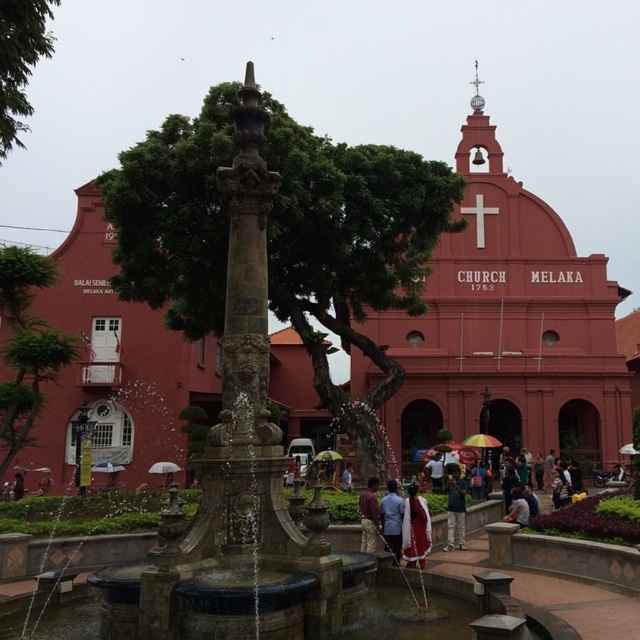
Does matte red dress at center come in front of light blue shirt at center?

No, matte red dress at center is further to the viewer.

Is matte red dress at center further to camera compared to light blue shirt at center?

Yes, matte red dress at center is further from the viewer.

Which is in front, point (403, 532) or point (401, 547)?

Positioned in front is point (401, 547).

Locate an element on the screen. The height and width of the screenshot is (640, 640). matte red dress at center is located at coordinates (416, 529).

Is point (342, 248) positioned in front of point (452, 468)?

Yes, point (342, 248) is closer to viewer.

The height and width of the screenshot is (640, 640). I want to click on green leafy tree at center, so click(349, 252).

Looking at this image, does matte red dress at center have a greater height compared to green fabric umbrella at center?

Yes.

Which is below, matte red dress at center or green fabric umbrella at center?

Positioned lower is green fabric umbrella at center.

Is point (416, 492) positioned in front of point (451, 484)?

Yes, it is.

Find the location of `matte red dress at center`. matte red dress at center is located at coordinates point(416,529).